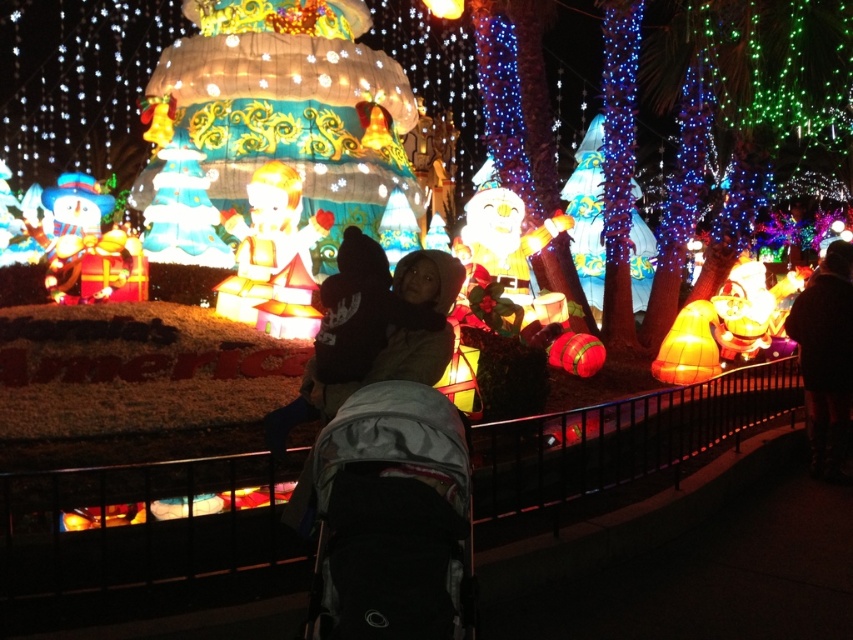
Is gray fabric baby carriage at center to the right of dark brown leather jacket at right from the viewer's perspective?

In fact, gray fabric baby carriage at center is to the left of dark brown leather jacket at right.

Does gray fabric baby carriage at center have a greater height compared to dark brown leather jacket at right?

No, gray fabric baby carriage at center is not taller than dark brown leather jacket at right.

Which is behind, point (466, 474) or point (844, 314)?

Point (844, 314)

Find the location of a particular element. gray fabric baby carriage at center is located at coordinates (393, 515).